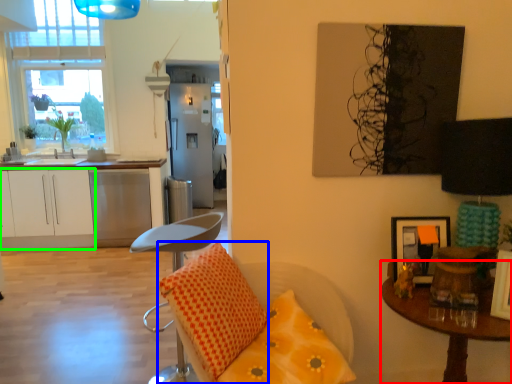
Question: Which is nearer to the table (highlighted by a red box)? pillow (highlighted by a blue box) or cabinetry (highlighted by a green box).

Choices:
 (A) pillow
 (B) cabinetry

Answer: (A)